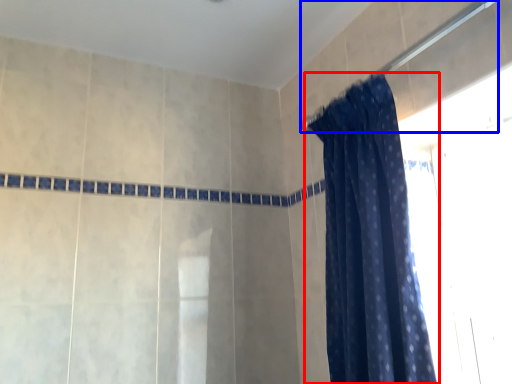
Question: Which object appears farthest to the camera in this image, curtain (highlighted by a red box) or shower (highlighted by a blue box)?

Choices:
 (A) curtain
 (B) shower

Answer: (A)